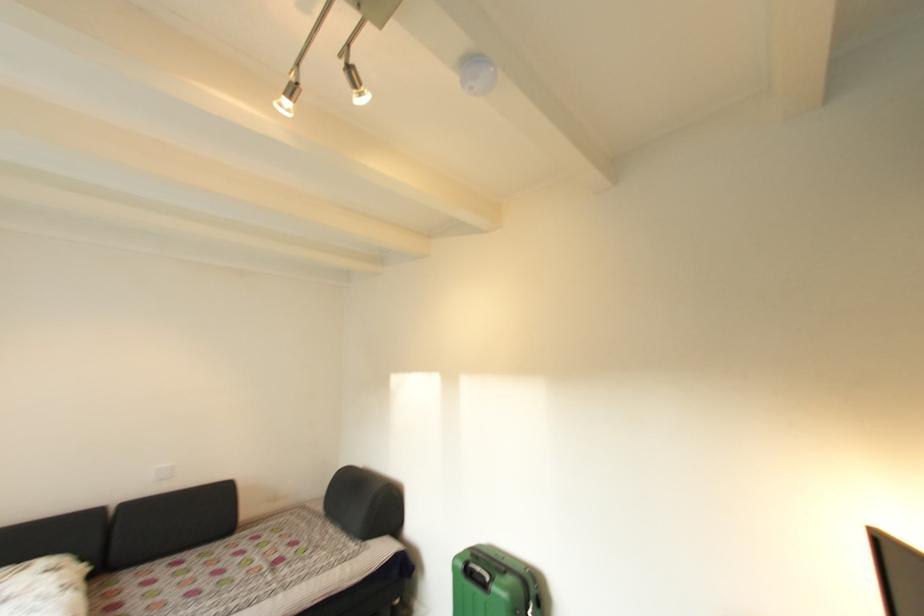
The width and height of the screenshot is (924, 616). Find the location of `black sofa armrest`. black sofa armrest is located at coordinates (363, 503).